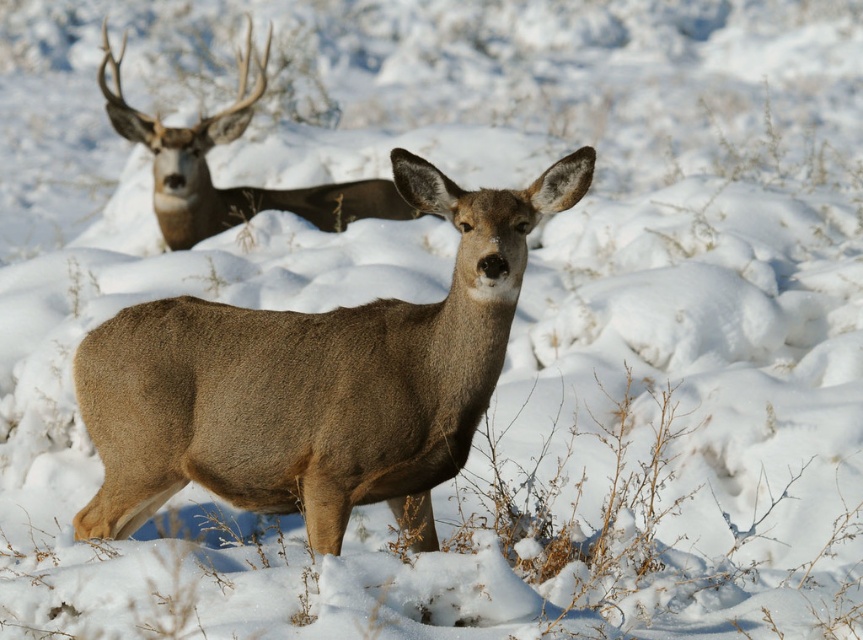
Question: Is brown fur deer at center smaller than brown velvet antlers at upper left?

Choices:
 (A) no
 (B) yes

Answer: (B)

Question: Among these points, which one is nearest to the camera?

Choices:
 (A) (269, 195)
 (B) (215, 480)

Answer: (B)

Question: Which point appears farthest from the camera in this image?

Choices:
 (A) (464, 244)
 (B) (206, 138)

Answer: (B)

Question: Which point is farther from the camera taking this photo?

Choices:
 (A) pos(342,317)
 (B) pos(265,44)

Answer: (B)

Question: Does brown fur deer at center have a greater width compared to brown velvet antlers at upper left?

Choices:
 (A) no
 (B) yes

Answer: (A)

Question: Can you confirm if brown fur deer at center is positioned to the right of brown velvet antlers at upper left?

Choices:
 (A) no
 (B) yes

Answer: (B)